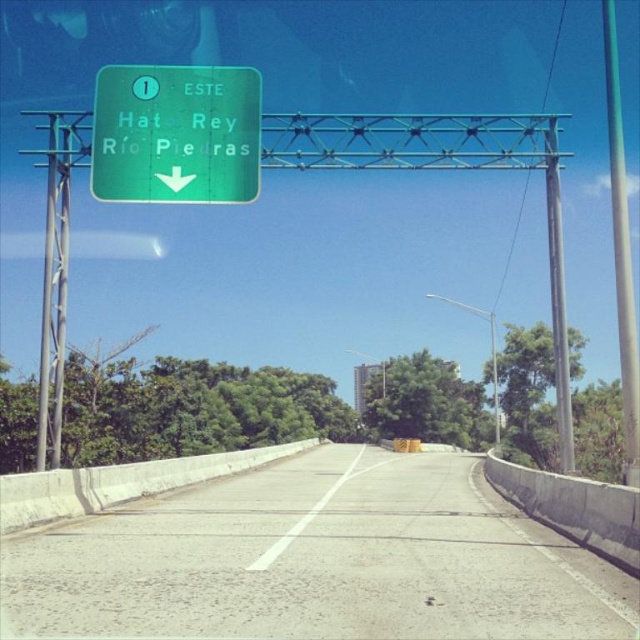
Question: Which object is closer to the camera taking this photo?

Choices:
 (A) gray concrete highway at center
 (B) green glossy sign at upper center

Answer: (A)

Question: Considering the relative positions of green metallic pole at right and metallic gray pole at right in the image provided, where is green metallic pole at right located with respect to metallic gray pole at right?

Choices:
 (A) below
 (B) above

Answer: (B)

Question: Is green glossy sign at upper center closer to the viewer compared to metallic gray pole at right?

Choices:
 (A) no
 (B) yes

Answer: (B)

Question: Which object is positioned closest to the gray concrete highway at center?

Choices:
 (A) green metallic pole at right
 (B) metallic gray pole at right

Answer: (B)

Question: Among these points, which one is farthest from the camera?

Choices:
 (A) (256, 188)
 (B) (628, 365)
 (C) (556, 301)
 (D) (92, 589)

Answer: (C)

Question: Is green glossy sign at upper center further to the viewer compared to green metallic pole at right?

Choices:
 (A) yes
 (B) no

Answer: (A)